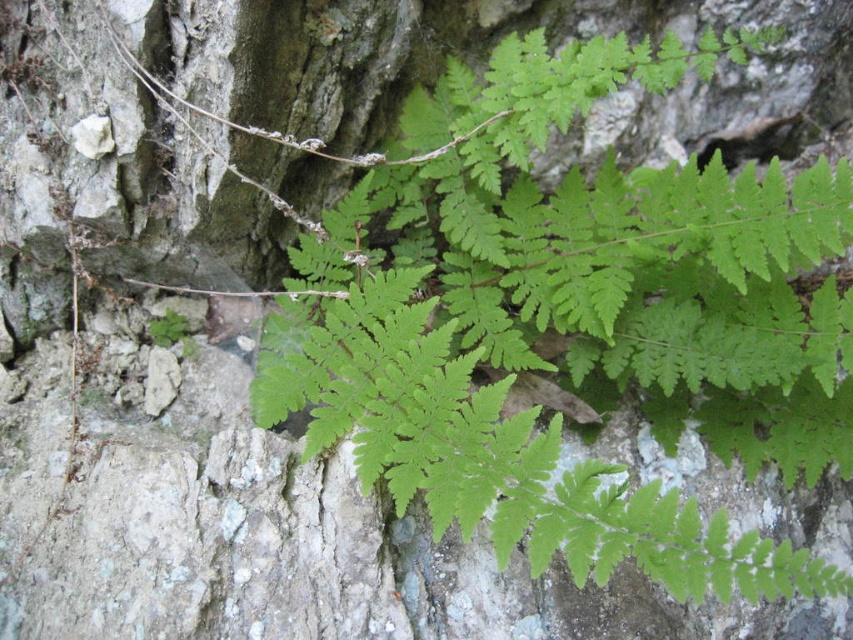
Question: Does green leafy fern at upper right have a greater width compared to green leafy plant at upper left?

Choices:
 (A) no
 (B) yes

Answer: (B)

Question: Where is green leafy fern at upper right located in relation to green leafy plant at upper left in the image?

Choices:
 (A) below
 (B) above

Answer: (B)

Question: Which point is closer to the camera taking this photo?

Choices:
 (A) (544, 470)
 (B) (151, 328)

Answer: (A)

Question: Does green leafy fern at upper right have a greater width compared to green leafy plant at upper left?

Choices:
 (A) yes
 (B) no

Answer: (A)

Question: Which of the following is the farthest from the observer?

Choices:
 (A) (491, 476)
 (B) (167, 344)

Answer: (B)